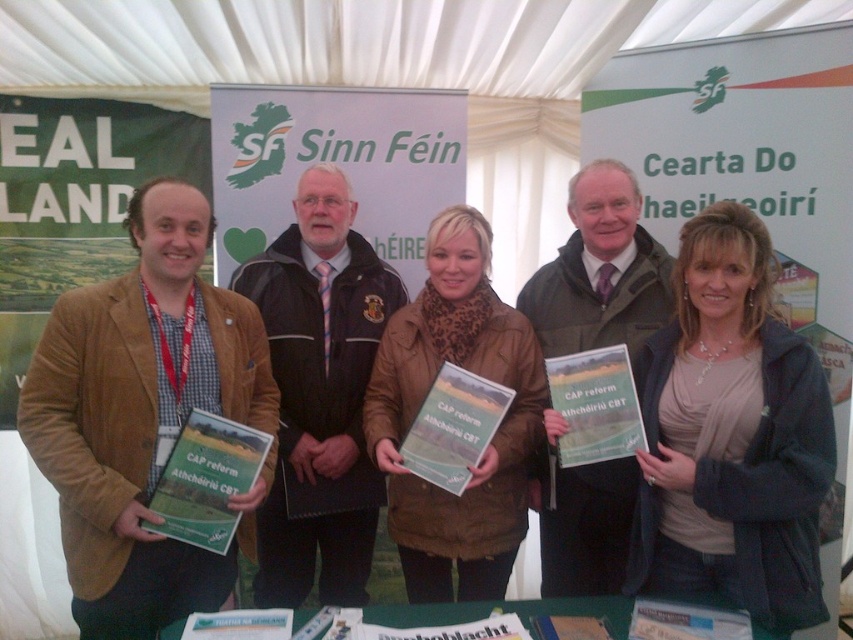
Question: Can you confirm if brown textured jacket at center is positioned below dark brown leather jacket at center?

Choices:
 (A) no
 (B) yes

Answer: (B)

Question: Is brown textured jacket at center to the right of brown leather jacket at center from the viewer's perspective?

Choices:
 (A) yes
 (B) no

Answer: (A)

Question: Which of the following is the closest to the observer?

Choices:
 (A) green fabric table at center
 (B) dark brown leather jacket at center

Answer: (A)

Question: Which of the following is the farthest from the observer?

Choices:
 (A) brown suede jacket at left
 (B) green fabric table at center
 (C) brown leather jacket at center
 (D) dark brown leather jacket at center

Answer: (D)

Question: Does brown suede jacket at left appear on the left side of green fabric table at center?

Choices:
 (A) yes
 (B) no

Answer: (A)

Question: Based on their relative distances, which object is nearer to the dark brown leather jacket at center?

Choices:
 (A) brown leather jacket at center
 (B) green fabric table at center

Answer: (A)